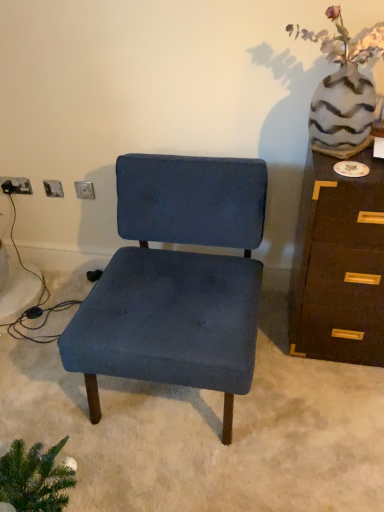
Question: From a real-world perspective, relative to matte silver outlet at lower left, which is counted as the first electric outlet, starting from the back, is velvet blue chair at center vertically above or below?

Choices:
 (A) below
 (B) above

Answer: (A)

Question: Looking at the image, does velvet blue chair at center seem bigger or smaller compared to matte silver outlet at lower left, which is counted as the first electric outlet, starting from the back?

Choices:
 (A) big
 (B) small

Answer: (A)

Question: Which of these objects is positioned farthest from the velvet blue chair at center?

Choices:
 (A) brown wood chest of drawers at right
 (B) matte silver outlet at lower left, arranged as the 1th electric outlet when viewed from the left
 (C) speckled ceramic vase at upper right
 (D) metallic silver electric outlet at upper left, which is the second electric outlet from left to right

Answer: (B)

Question: Which of these objects is positioned farthest from the brown wood chest of drawers at right?

Choices:
 (A) metallic silver electric outlet at upper left, which is counted as the 2th electric outlet, starting from the back
 (B) matte silver outlet at lower left, the second electric outlet viewed from the right
 (C) velvet blue chair at center
 (D) speckled ceramic vase at upper right

Answer: (B)